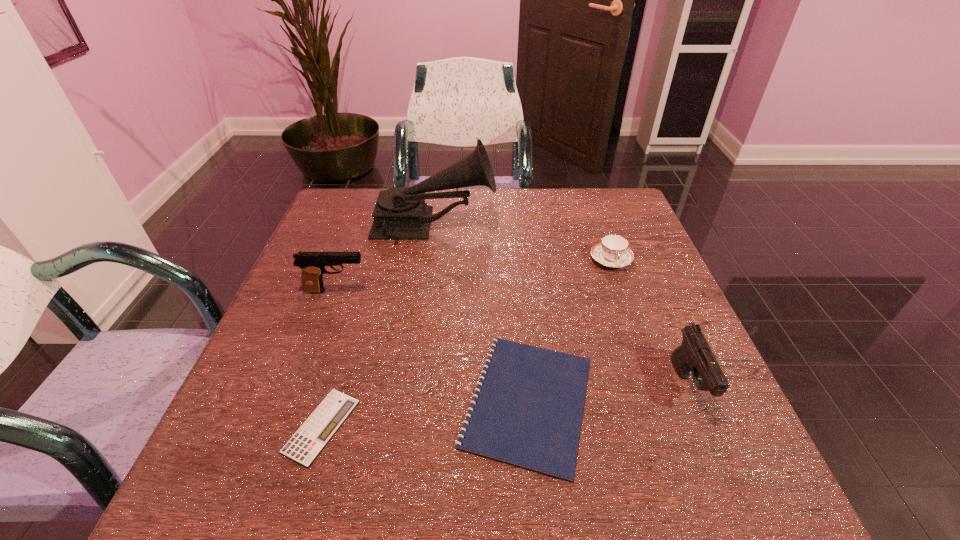
Locate an element on the screen. the farthest object is located at coordinates (400, 213).

This screenshot has width=960, height=540. In order to click on the tallest object in this screenshot , I will do `click(400, 213)`.

This screenshot has height=540, width=960. I want to click on the fourth nearest object, so click(x=313, y=264).

Image resolution: width=960 pixels, height=540 pixels. Identify the location of the left pistol. (313, 264).

Image resolution: width=960 pixels, height=540 pixels. What are the coordinates of `the right pistol` in the screenshot? It's located at (694, 354).

Find the location of a particular element. teacup is located at coordinates (612, 251).

What are the coordinates of `the fifth nearest object` in the screenshot? It's located at (612, 251).

Where is `the second shortest object`? the second shortest object is located at coordinates (529, 412).

Identify the location of calculator. This screenshot has height=540, width=960. (x=310, y=439).

The height and width of the screenshot is (540, 960). Identify the location of free space located from the horn of the tallest object. (541, 226).